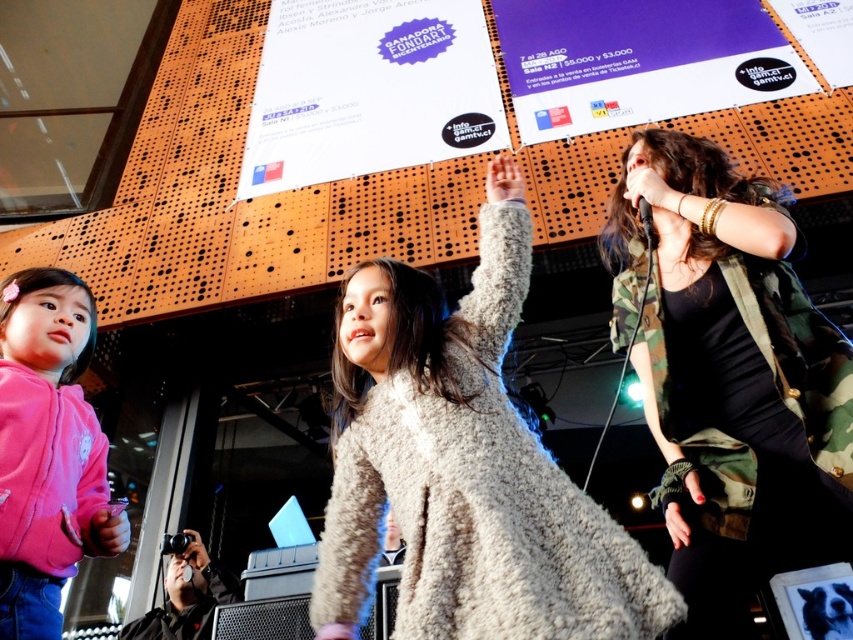
Which is behind, point (70, 381) or point (660, 188)?

Point (70, 381)

Is pink fleece jacket at lower left below camouflage fabric hand at upper right?

Indeed, pink fleece jacket at lower left is positioned under camouflage fabric hand at upper right.

Describe the element at coordinates (47, 451) in the screenshot. The width and height of the screenshot is (853, 640). I see `pink fleece jacket at lower left` at that location.

This screenshot has height=640, width=853. Identify the location of pink fleece jacket at lower left. (47, 451).

Can you confirm if fluffy beige coat at center is wider than black matte camera at lower left?

Indeed, fluffy beige coat at center has a greater width compared to black matte camera at lower left.

Is fluffy beige coat at center closer to camera compared to black matte camera at lower left?

Yes, it is.

Who is more forward, (331, 486) or (201, 552)?

Positioned in front is point (201, 552).

At what (x,y) coordinates should I click in order to perform the action: click on fluffy beige coat at center. Please return your answer as a coordinate pair (x, y). This screenshot has width=853, height=640. Looking at the image, I should click on (465, 472).

Is point (670, 44) positioned before point (790, 3)?

Yes, it is.

Between point (527, 8) and point (834, 32), which one is positioned behind?

Positioned behind is point (527, 8).

The image size is (853, 640). Identify the location of purple paper poster at upper center. (637, 61).